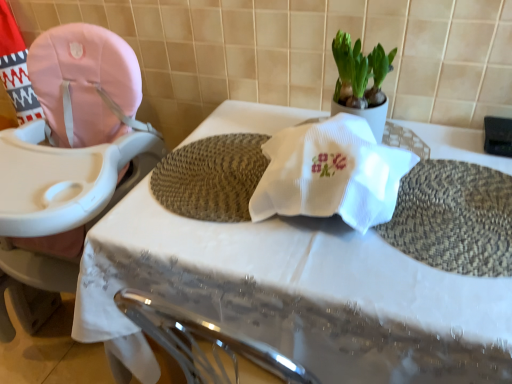
In order to click on vacant area that lies to the right of green leafy plant at upper center in this screenshot , I will do `click(430, 137)`.